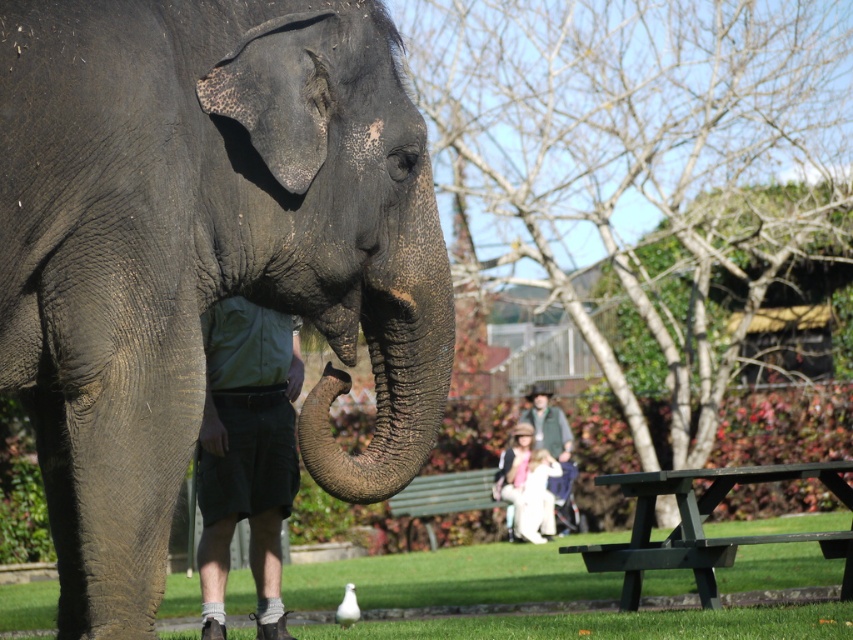
Question: Which of the following is the closest to the observer?

Choices:
 (A) dark gray wrinkled skin elephant at center
 (B) green wood picnic table at lower right
 (C) light brown fabric jacket at lower center
 (D) green fabric jacket at center

Answer: (A)

Question: Can you confirm if green grass at lower center is smaller than green fabric shorts at lower left?

Choices:
 (A) yes
 (B) no

Answer: (B)

Question: Can you confirm if green wood picnic table at lower right is positioned to the right of green fabric jacket at center?

Choices:
 (A) no
 (B) yes

Answer: (A)

Question: Is green grass at lower center closer to the viewer compared to light brown fabric jacket at lower center?

Choices:
 (A) no
 (B) yes

Answer: (B)

Question: Which point is closer to the camera?

Choices:
 (A) green wooden bench at lower center
 (B) green wood picnic table at lower right
 (C) green fabric shorts at lower left
 (D) light brown fabric jacket at lower center

Answer: (C)

Question: Estimate the real-world distances between objects in this image. Which object is farther from the light brown fabric jacket at lower center?

Choices:
 (A) green wood picnic table at lower right
 (B) green fabric shorts at lower left
 (C) green grass at lower center
 (D) green fabric jacket at center

Answer: (B)